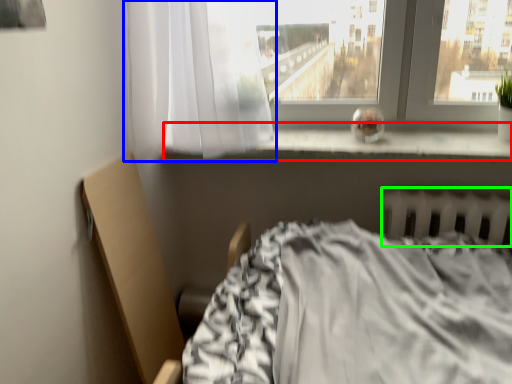
Question: Which object is positioned closest to window sill (highlighted by a red box)? Select from curtain (highlighted by a blue box) and radiator (highlighted by a green box).

Choices:
 (A) curtain
 (B) radiator

Answer: (B)